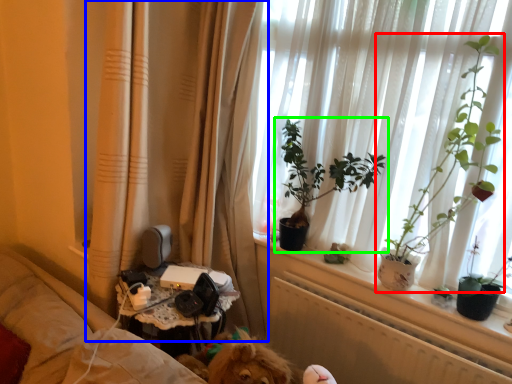
Question: Which object is the farthest from houseplant (highlighted by a red box)? Choose among these: curtain (highlighted by a blue box) or houseplant (highlighted by a green box).

Choices:
 (A) curtain
 (B) houseplant

Answer: (A)